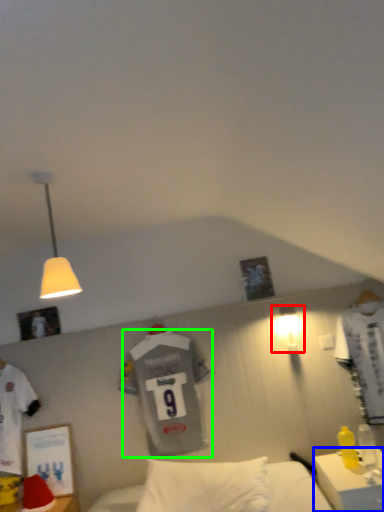
Question: Which is farther away from lamp (highlighted by a red box)? desk (highlighted by a blue box) or t shirt (highlighted by a green box)?

Choices:
 (A) desk
 (B) t shirt

Answer: (A)